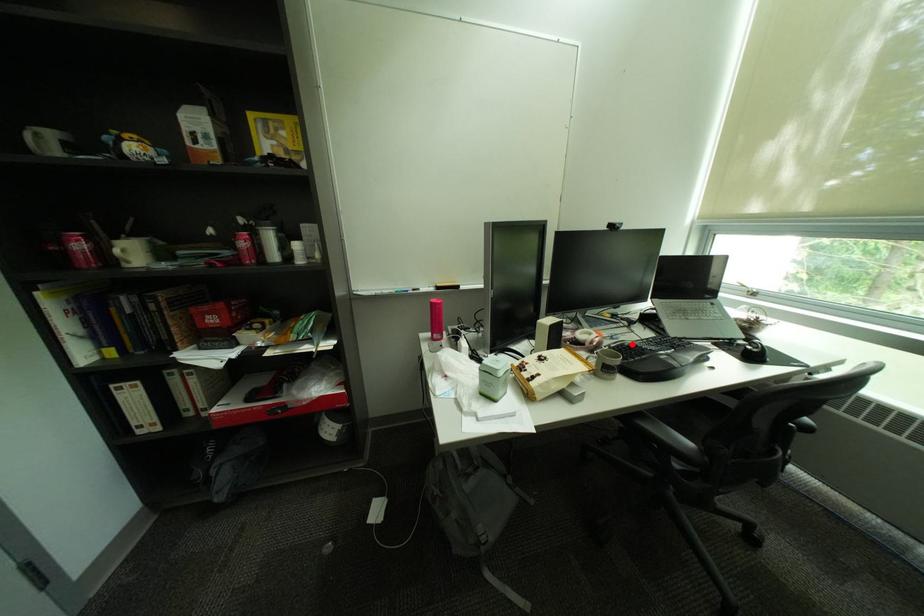
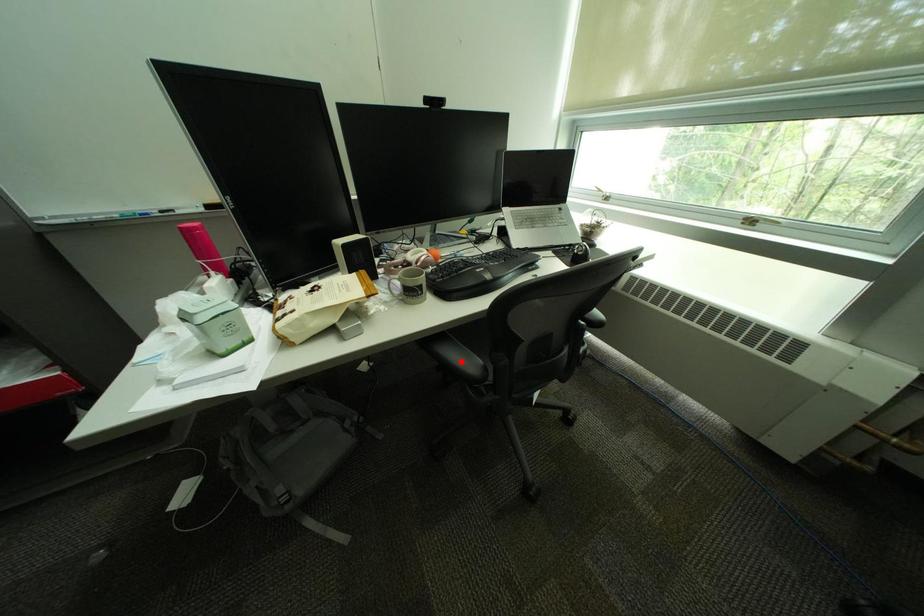
I am providing you with two images of the same scene from different viewpoints. A red point is marked on the first image and another point is marked on the second image. Do the highlighted points in image1 and image2 indicate the same real-world spot?

No